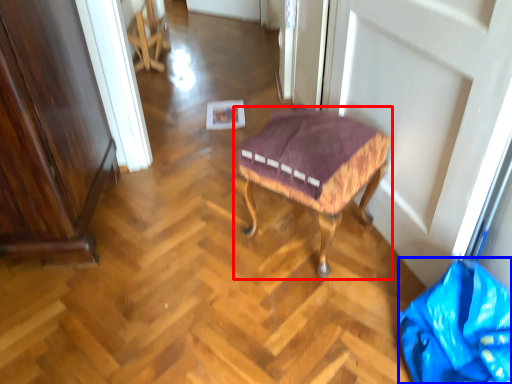
Question: Which object appears closest to the camera in this image, stool (highlighted by a red box) or material (highlighted by a blue box)?

Choices:
 (A) stool
 (B) material

Answer: (B)